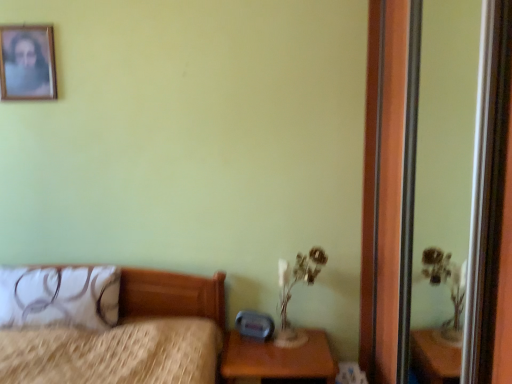
Question: Is wooden picture frame at upper left to the left of translucent glass table lamp at lower right from the viewer's perspective?

Choices:
 (A) yes
 (B) no

Answer: (A)

Question: Is wooden picture frame at upper left looking in the opposite direction of translucent glass table lamp at lower right?

Choices:
 (A) yes
 (B) no

Answer: (B)

Question: From a real-world perspective, is wooden picture frame at upper left physically below translucent glass table lamp at lower right?

Choices:
 (A) no
 (B) yes

Answer: (A)

Question: Does wooden picture frame at upper left have a lesser width compared to translucent glass table lamp at lower right?

Choices:
 (A) yes
 (B) no

Answer: (A)

Question: Is wooden picture frame at upper left at the right side of translucent glass table lamp at lower right?

Choices:
 (A) yes
 (B) no

Answer: (B)

Question: Considering their positions, is wooden picture frame at upper left located in front of or behind translucent glass table lamp at lower right?

Choices:
 (A) behind
 (B) front

Answer: (A)

Question: In terms of width, does wooden picture frame at upper left look wider or thinner when compared to translucent glass table lamp at lower right?

Choices:
 (A) thin
 (B) wide

Answer: (A)

Question: Is wooden picture frame at upper left bigger or smaller than translucent glass table lamp at lower right?

Choices:
 (A) small
 (B) big

Answer: (A)

Question: From a real-world perspective, is wooden picture frame at upper left above or below translucent glass table lamp at lower right?

Choices:
 (A) below
 (B) above

Answer: (B)

Question: Is brown wooden nightstand at lower right inside the boundaries of white fabric pillow at left, or outside?

Choices:
 (A) outside
 (B) inside

Answer: (A)

Question: From the image's perspective, relative to white fabric pillow at left, is brown wooden nightstand at lower right above or below?

Choices:
 (A) above
 (B) below

Answer: (B)

Question: Looking at their shapes, would you say brown wooden nightstand at lower right is wider or thinner than white fabric pillow at left?

Choices:
 (A) thin
 (B) wide

Answer: (B)

Question: Based on their positions, is brown wooden nightstand at lower right located to the left or right of white fabric pillow at left?

Choices:
 (A) left
 (B) right

Answer: (B)

Question: Does point (388, 271) appear closer or farther from the camera than point (28, 311)?

Choices:
 (A) closer
 (B) farther

Answer: (A)

Question: Relative to white fabric pillow at left, is transparent glass screen door at right in front or behind?

Choices:
 (A) front
 (B) behind

Answer: (A)